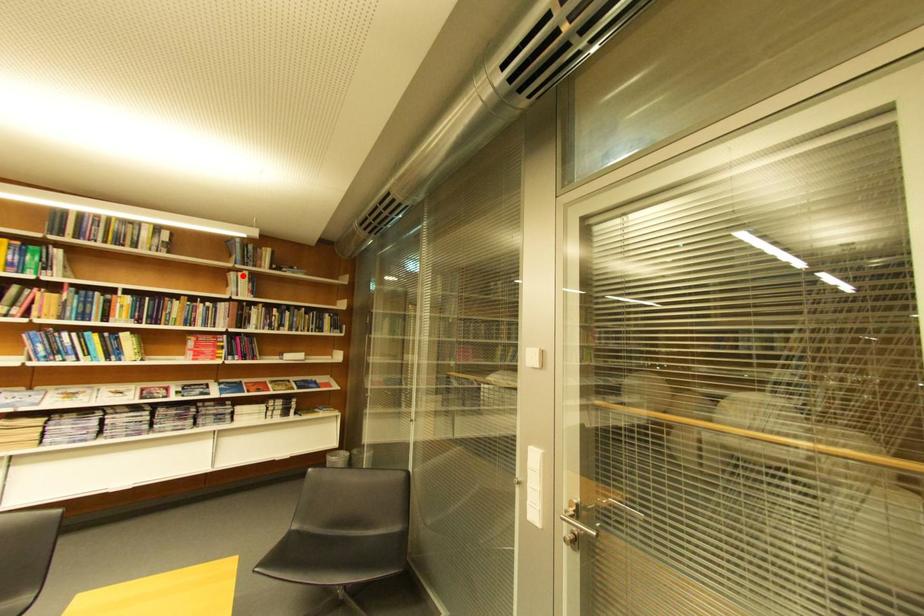
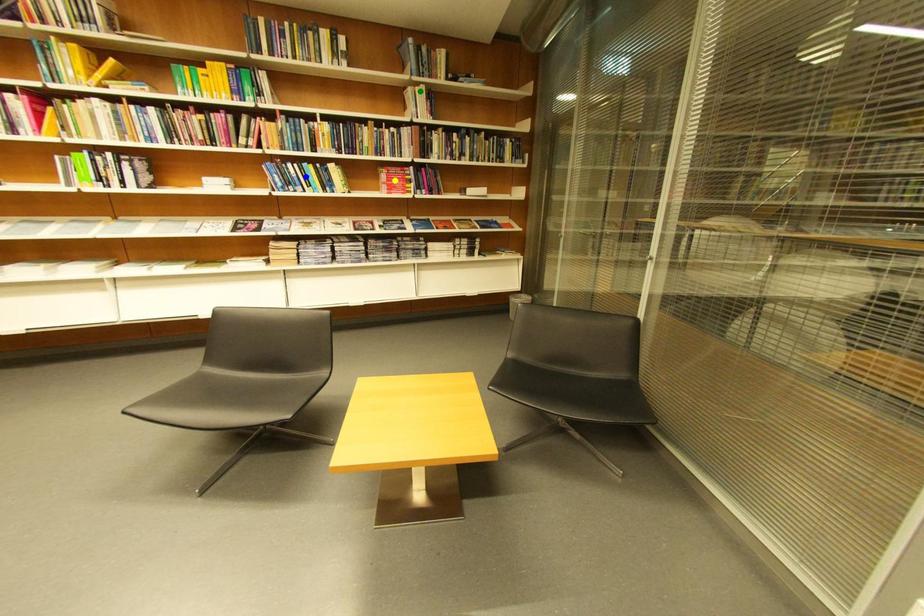
Question: I am providing you with two images of the same scene from different viewpoints. A red point is marked on the first image. You are given multiple points on the second image. Which point in image 2 represents the same 3d spot as the red point in image 1?

Choices:
 (A) blue point
 (B) green point
 (C) yellow point

Answer: (B)